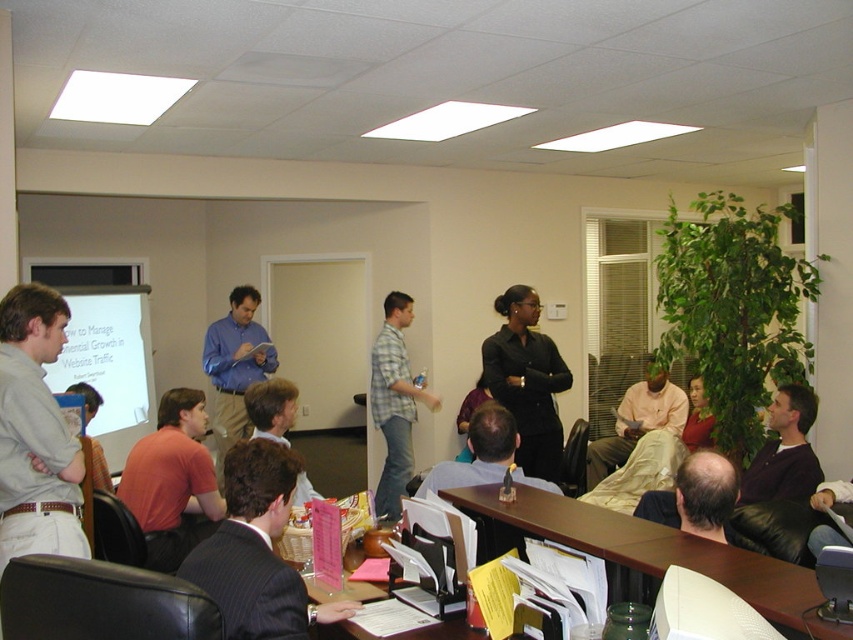
Question: Which object is positioned farthest from the light gray shirt at left?

Choices:
 (A) brown wood table at lower center
 (B) light brown leather jacket at center
 (C) dark gray suit at center
 (D) blue shirt at center

Answer: (D)

Question: Is light gray shirt at left below blue shirt at center?

Choices:
 (A) yes
 (B) no

Answer: (B)

Question: Which of the following is the closest to the observer?

Choices:
 (A) dark brown leather jacket at lower right
 (B) light brown leather jacket at center

Answer: (A)

Question: Is blue shirt at center to the left of dark brown leather jacket at lower right from the viewer's perspective?

Choices:
 (A) yes
 (B) no

Answer: (A)

Question: Which point is closer to the camera?

Choices:
 (A) coord(807,582)
 (B) coord(798,390)

Answer: (A)

Question: Considering the relative positions of brown wood table at lower center and blue shirt at center in the image provided, where is brown wood table at lower center located with respect to blue shirt at center?

Choices:
 (A) left
 (B) right

Answer: (B)